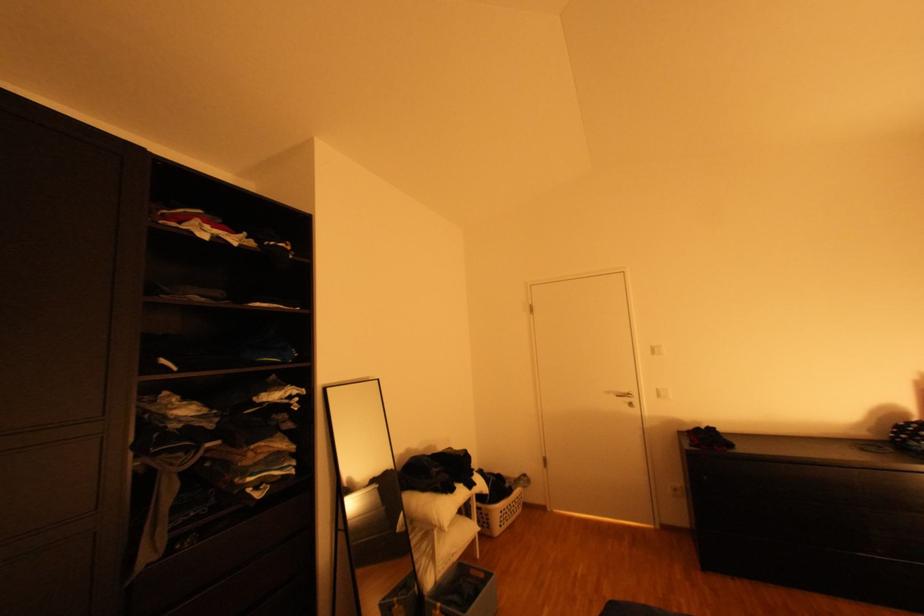
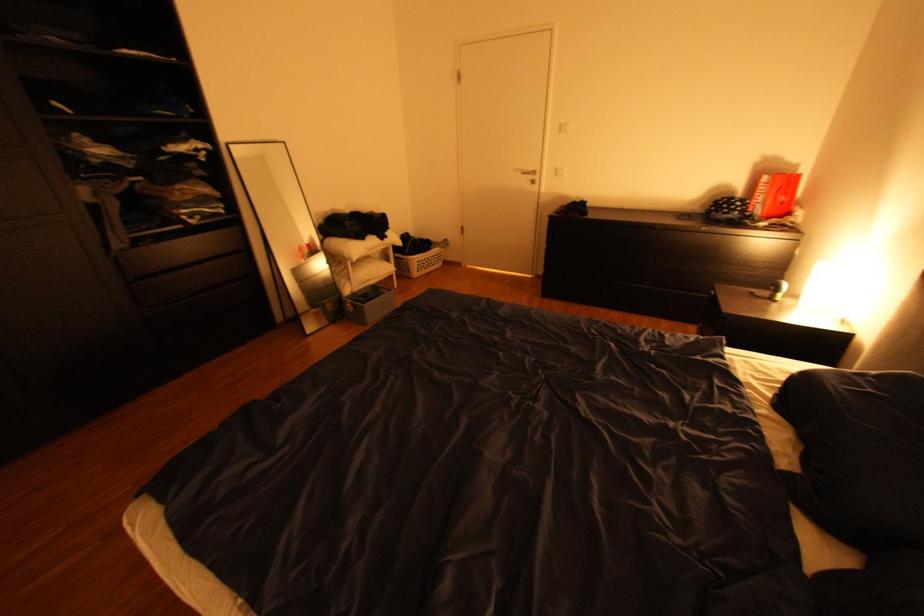
In the second image, find the point that corresponds to pixel 667 527 in the first image.

(543, 276)